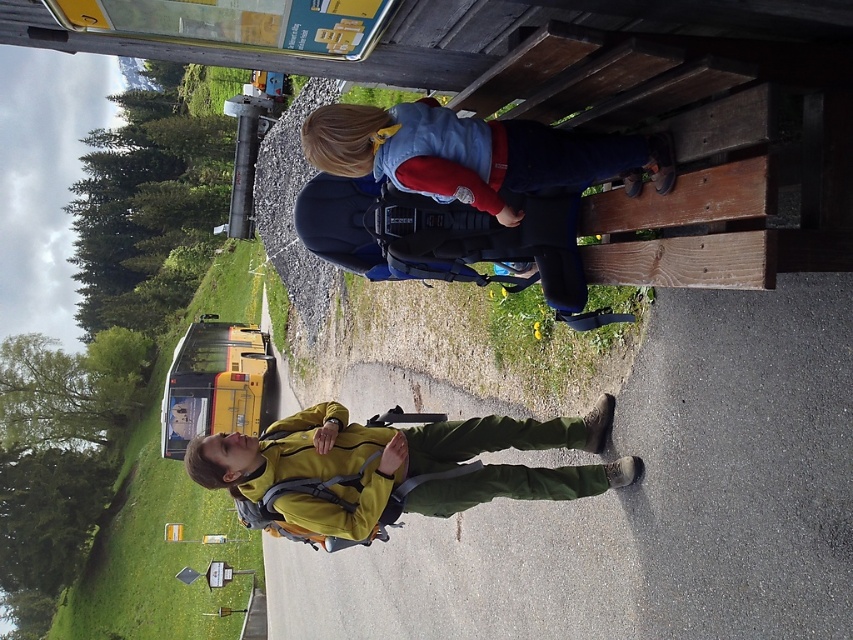
Question: Based on their relative distances, which object is farther from the matte yellow jacket at lower center?

Choices:
 (A) denim jacket at upper center
 (B) yellow matte school bus at left

Answer: (B)

Question: Does denim jacket at upper center have a lesser width compared to yellow matte school bus at left?

Choices:
 (A) no
 (B) yes

Answer: (B)

Question: Which of these objects is positioned closest to the yellow matte school bus at left?

Choices:
 (A) matte yellow jacket at lower center
 (B) denim jacket at upper center

Answer: (A)

Question: Can you confirm if matte yellow jacket at lower center is positioned below denim jacket at upper center?

Choices:
 (A) yes
 (B) no

Answer: (A)

Question: Considering the real-world distances, which object is farthest from the matte yellow jacket at lower center?

Choices:
 (A) yellow matte school bus at left
 (B) denim jacket at upper center

Answer: (A)

Question: Does denim jacket at upper center have a larger size compared to yellow matte school bus at left?

Choices:
 (A) yes
 (B) no

Answer: (B)